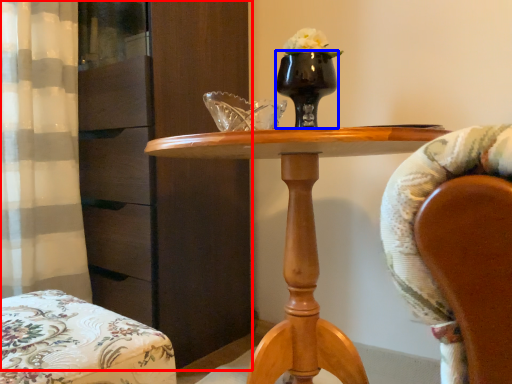
Question: Which of the following is the closest to the observer, dresser (highlighted by a red box) or vase (highlighted by a blue box)?

Choices:
 (A) dresser
 (B) vase

Answer: (B)